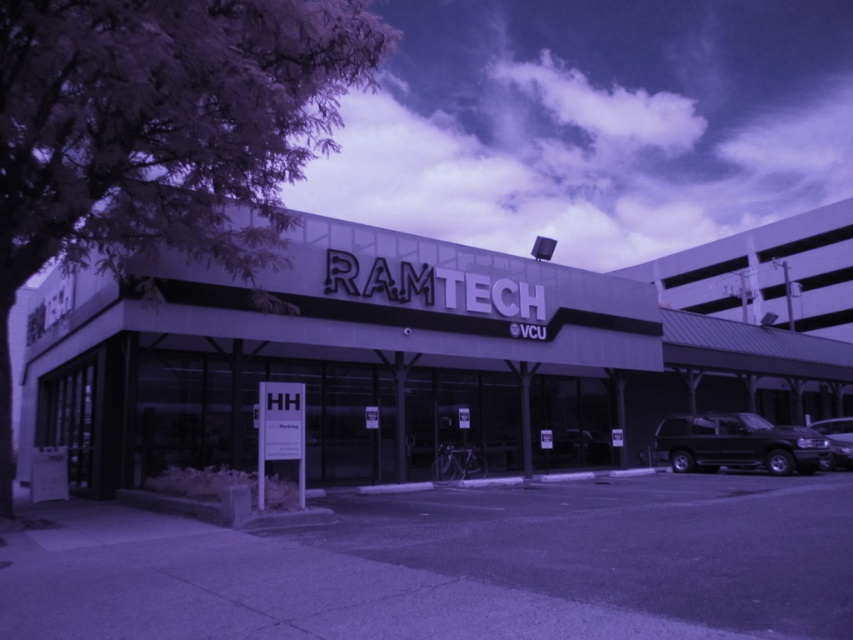
Based on the photo, can you confirm if white matte building at center is taller than black matte van at lower right?

Yes.

Which is below, white matte building at center or black matte van at lower right?

Positioned lower is black matte van at lower right.

Who is more distant from viewer, (392, 260) or (821, 429)?

Point (821, 429)

Where is `white matte building at center`? The image size is (853, 640). white matte building at center is located at coordinates (434, 353).

Which is more to the left, black matte suv at center or black matte van at lower right?

black matte suv at center

Between point (659, 445) and point (842, 451), which one is positioned in front?

Point (842, 451)

Where is `black matte suv at center`? The image size is (853, 640). black matte suv at center is located at coordinates (737, 444).

Does white matte building at center have a greater height compared to black matte suv at center?

Yes, white matte building at center is taller than black matte suv at center.

Between white matte building at center and black matte suv at center, which one is positioned lower?

black matte suv at center

Describe the element at coordinates (434, 353) in the screenshot. This screenshot has height=640, width=853. I see `white matte building at center` at that location.

Image resolution: width=853 pixels, height=640 pixels. I want to click on white matte building at center, so click(434, 353).